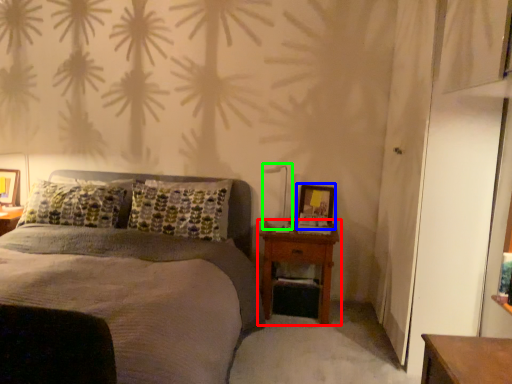
Question: Considering the real-world distances, which object is farthest from nightstand (highlighted by a red box)? picture frame (highlighted by a blue box) or bedside lamp (highlighted by a green box)?

Choices:
 (A) picture frame
 (B) bedside lamp

Answer: (B)